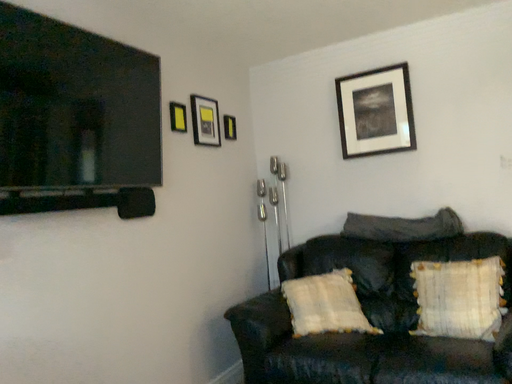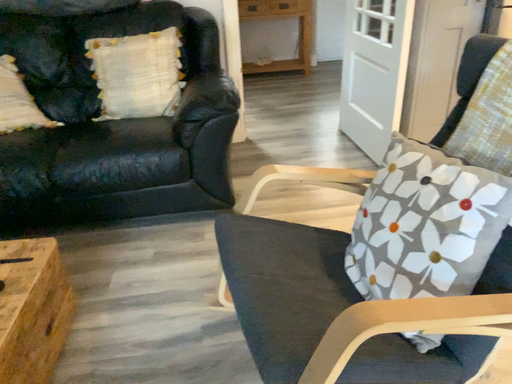
Question: How did the camera likely rotate when shooting the video?

Choices:
 (A) rotated downward
 (B) rotated upward

Answer: (A)